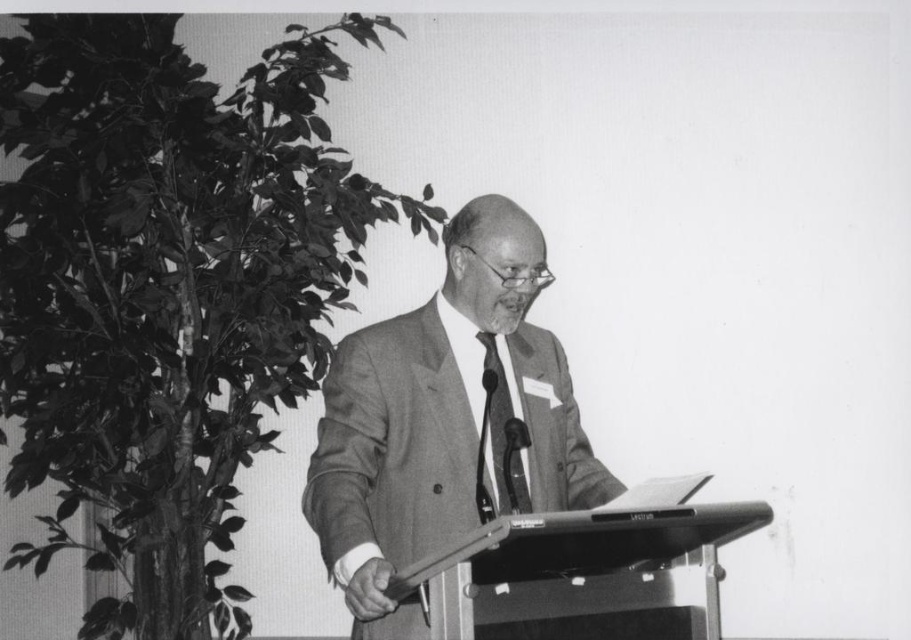
Question: Does smooth gray suit at center lie in front of metallic gray podium at center?

Choices:
 (A) yes
 (B) no

Answer: (B)

Question: Which point is farther to the camera?

Choices:
 (A) smooth gray suit at center
 (B) metallic/reflective microphone at center

Answer: (B)

Question: Which point is closer to the camera?

Choices:
 (A) (703, 545)
 (B) (495, 385)

Answer: (A)

Question: Is metallic gray podium at center closer to camera compared to metallic/reflective microphone at center?

Choices:
 (A) yes
 (B) no

Answer: (A)

Question: In this image, where is metallic gray podium at center located relative to matte black tie at center?

Choices:
 (A) right
 (B) left

Answer: (A)

Question: Which of the following is the closest to the observer?

Choices:
 (A) matte black tie at center
 (B) metallic/reflective microphone at center
 (C) smooth gray suit at center
 (D) metallic gray podium at center

Answer: (D)